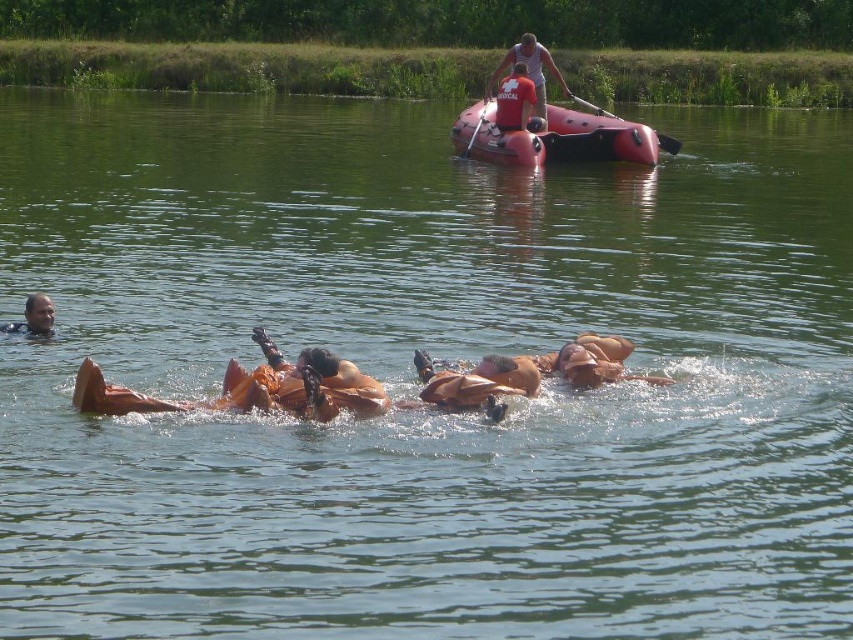
Is matte red life vest at upper center smaller than red matte life jacket at upper center?

No.

Describe the element at coordinates (529, 68) in the screenshot. I see `matte red life vest at upper center` at that location.

Between point (515, 56) and point (498, 116), which one is positioned behind?

The point (515, 56) is behind.

Find the location of `matte red life vest at upper center`. matte red life vest at upper center is located at coordinates (529, 68).

Does rubberized red boat at upper center have a larger size compared to matte red life vest at upper center?

No, rubberized red boat at upper center is not bigger than matte red life vest at upper center.

Is point (492, 120) more distant than point (543, 102)?

That is False.

Is point (628, 150) behind point (569, 96)?

No, it is not.

This screenshot has width=853, height=640. Find the location of `rubberized red boat at upper center`. rubberized red boat at upper center is located at coordinates (553, 138).

Measure the distance from red matte life jacket at upper center to rubber paddle at upper center.

red matte life jacket at upper center is 5.47 meters away from rubber paddle at upper center.

Does red matte life jacket at upper center appear on the right side of rubber paddle at upper center?

In fact, red matte life jacket at upper center is to the left of rubber paddle at upper center.

At what (x,y) coordinates should I click in order to perform the action: click on red matte life jacket at upper center. Please return your answer as a coordinate pair (x, y). The width and height of the screenshot is (853, 640). Looking at the image, I should click on (514, 99).